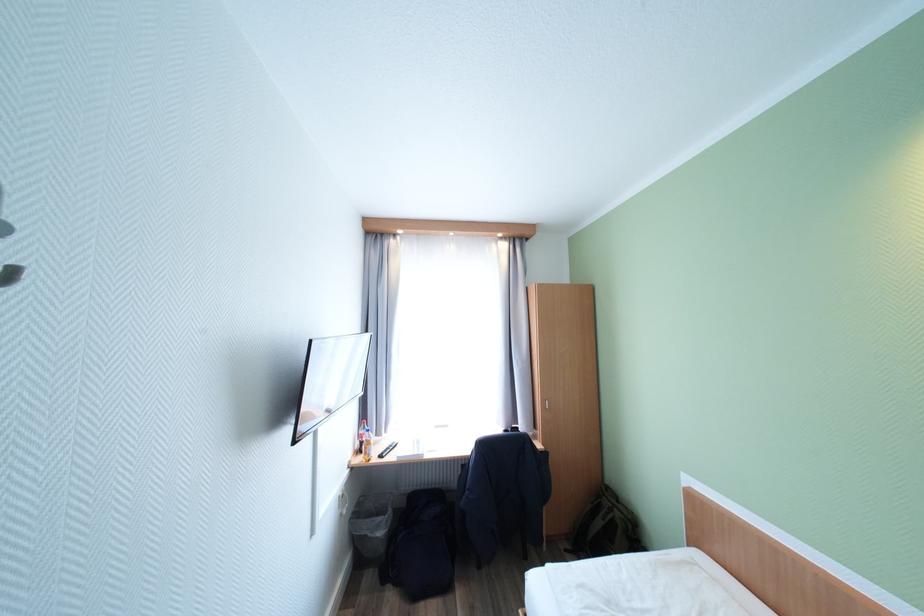
Find where to sit the chair sitting surface. Please return your answer as a coordinate pair (x, y).

(504, 493)